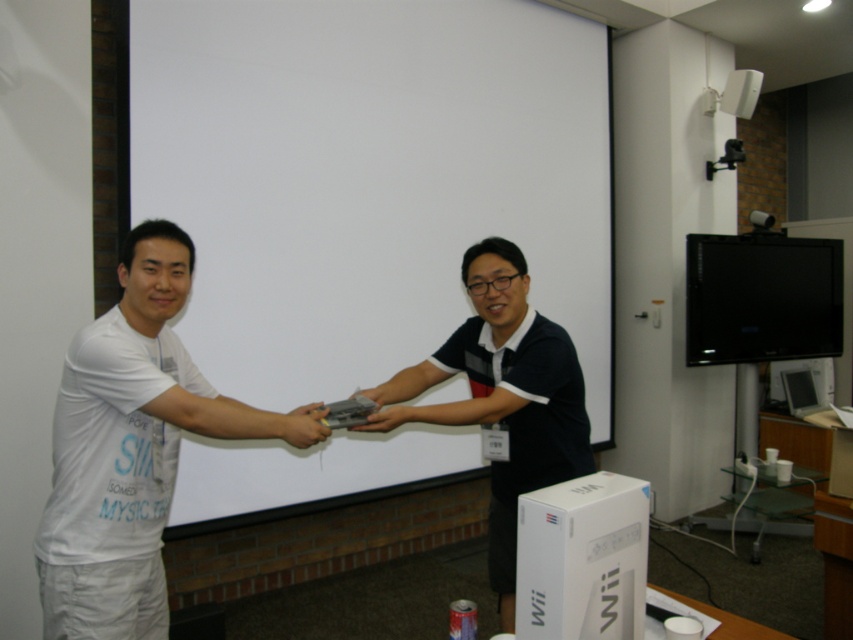
Can you confirm if black glossy tv at upper right is thinner than matte gray controller at center?

In fact, black glossy tv at upper right might be wider than matte gray controller at center.

Between black glossy tv at upper right and matte gray controller at center, which one has more height?

black glossy tv at upper right

Find the location of a particular element. Image resolution: width=853 pixels, height=640 pixels. black glossy tv at upper right is located at coordinates (762, 298).

Can you confirm if dark blue polo shirt at center is smaller than matte gray controller at center?

Actually, dark blue polo shirt at center might be larger than matte gray controller at center.

Consider the image. Which is more to the right, dark blue polo shirt at center or matte gray controller at center?

Positioned to the right is dark blue polo shirt at center.

Measure the distance between dark blue polo shirt at center and camera.

1.86 meters

I want to click on dark blue polo shirt at center, so click(x=502, y=396).

Is white matte projection screen at center taller than dark blue polo shirt at center?

Yes.

Which is in front, point (460, 461) or point (474, 292)?

Positioned in front is point (474, 292).

The image size is (853, 640). Find the location of `white matte projection screen at center`. white matte projection screen at center is located at coordinates (369, 179).